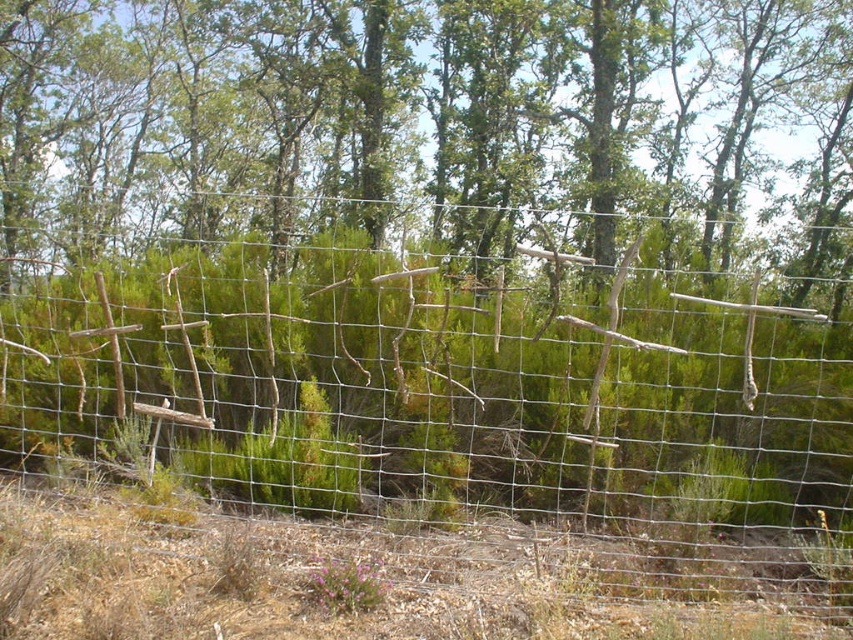
Question: Which of the following is the closest to the observer?

Choices:
 (A) green leafy tree at center
 (B) wire mesh fence at center

Answer: (B)

Question: Which point is closer to the camera?

Choices:
 (A) wire mesh fence at center
 (B) green leafy tree at center

Answer: (A)

Question: Can you confirm if wire mesh fence at center is positioned above green leafy tree at center?

Choices:
 (A) no
 (B) yes

Answer: (A)

Question: Can you confirm if wire mesh fence at center is positioned below green leafy tree at center?

Choices:
 (A) yes
 (B) no

Answer: (A)

Question: Is wire mesh fence at center further to camera compared to green leafy tree at center?

Choices:
 (A) no
 (B) yes

Answer: (A)